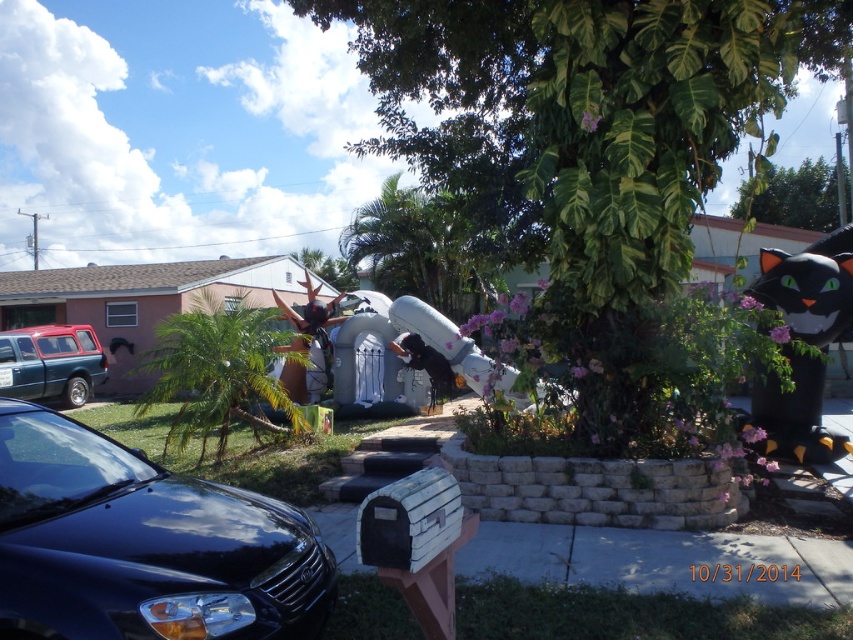
Question: Does metallic red station wagon at left appear over shiny metallic reindeer at center?

Choices:
 (A) no
 (B) yes

Answer: (A)

Question: Among these points, which one is farthest from the camera?

Choices:
 (A) (303, 285)
 (B) (331, 604)

Answer: (A)

Question: Can you confirm if metallic red station wagon at left is positioned below shiny metallic reindeer at center?

Choices:
 (A) no
 (B) yes

Answer: (B)

Question: Can you confirm if metallic red station wagon at left is smaller than shiny metallic reindeer at center?

Choices:
 (A) yes
 (B) no

Answer: (A)

Question: Among these points, which one is farthest from the camera?

Choices:
 (A) (41, 388)
 (B) (289, 394)
 (C) (238, 604)

Answer: (A)

Question: Estimate the real-world distances between objects in this image. Which object is closer to the shiny metallic reindeer at center?

Choices:
 (A) black matte cat at right
 (B) glossy black car at lower left
 (C) metallic red station wagon at left

Answer: (C)